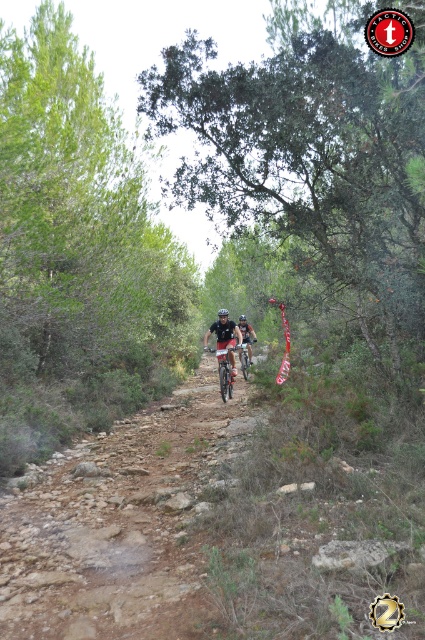
You are a mountain biker planning to take a shortcut through the trail. There is a point marked at coordinates point (x=121, y=522). Is this point on the dirt rocky terrain at center?

Yes, the dirt rocky terrain at center is located at point (x=121, y=522), so the point is on the dirt rocky terrain at center.